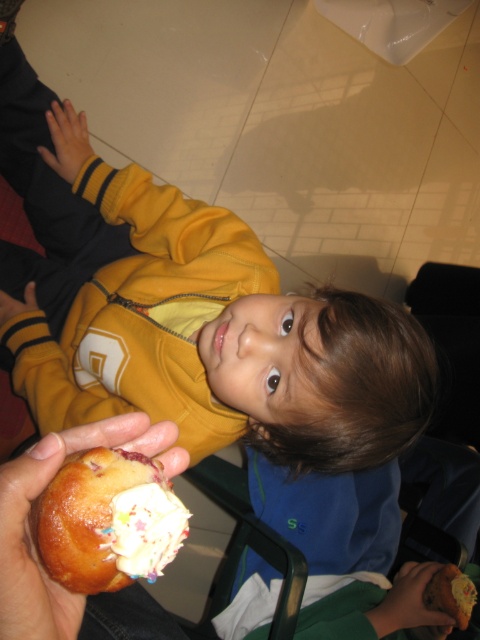
You are a pastry chef who needs to place a new pastry exactly 12 inches away from the viewer. The point in the image at coordinates point (x=170, y=557) is currently 11.70 inches away from the viewer. How much closer or farther should you move the pastry to meet the requirement?

The point at point (x=170, y=557) is currently 11.70 inches away from the viewer. To reach exactly 12 inches, the pastry should be moved 0.30 inches farther away from the viewer.

You are a child trying to reach the glazed doughnut at lower left and the dark brown leather hand at lower right. Which one is closer to your right side?

The dark brown leather hand at lower right is closer to your right side because it is positioned to the right of the glazed doughnut at lower left.

You are a pastry chef who needs to place the white glossy frosting at lower center onto the dark brown leather hand at lower right. Given the distance between them, can you estimate whether the frosting will reach the hand without spilling?

The distance between the white glossy frosting at lower center and the dark brown leather hand at lower right is 28.55 inches. Since this is a significant distance, there is a high likelihood of spilling if attempting to move the frosting directly without a container or tool.